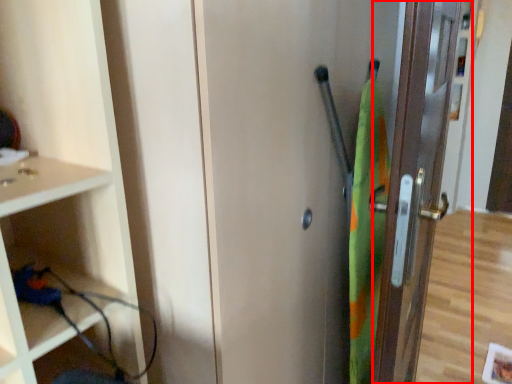
Question: Considering the relative positions of door (annotated by the red box) and screen door in the image provided, where is door (annotated by the red box) located with respect to the staircase?

Choices:
 (A) left
 (B) right

Answer: (B)